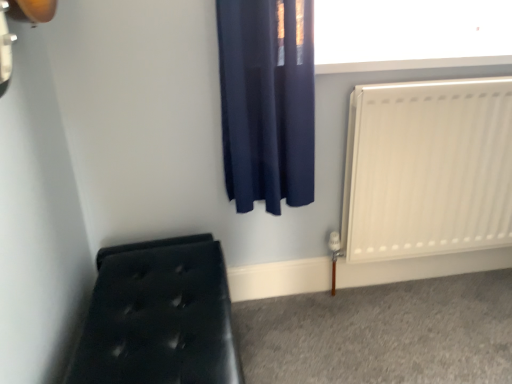
Question: From their relative heights in the image, would you say dark blue fabric curtain at upper center is taller or shorter than black tufted bench at lower left?

Choices:
 (A) short
 (B) tall

Answer: (B)

Question: Considering the relative positions of dark blue fabric curtain at upper center and black tufted bench at lower left in the image provided, is dark blue fabric curtain at upper center to the left or to the right of black tufted bench at lower left?

Choices:
 (A) right
 (B) left

Answer: (A)

Question: Considering the real-world distances, which object is closest to the white smooth window sill at upper center?

Choices:
 (A) dark blue fabric curtain at upper center
 (B) white matte radiator at right
 (C) black tufted bench at lower left

Answer: (A)

Question: Based on their relative distances, which object is farther from the black tufted bench at lower left?

Choices:
 (A) dark blue fabric curtain at upper center
 (B) white matte radiator at right
 (C) white smooth window sill at upper center

Answer: (C)